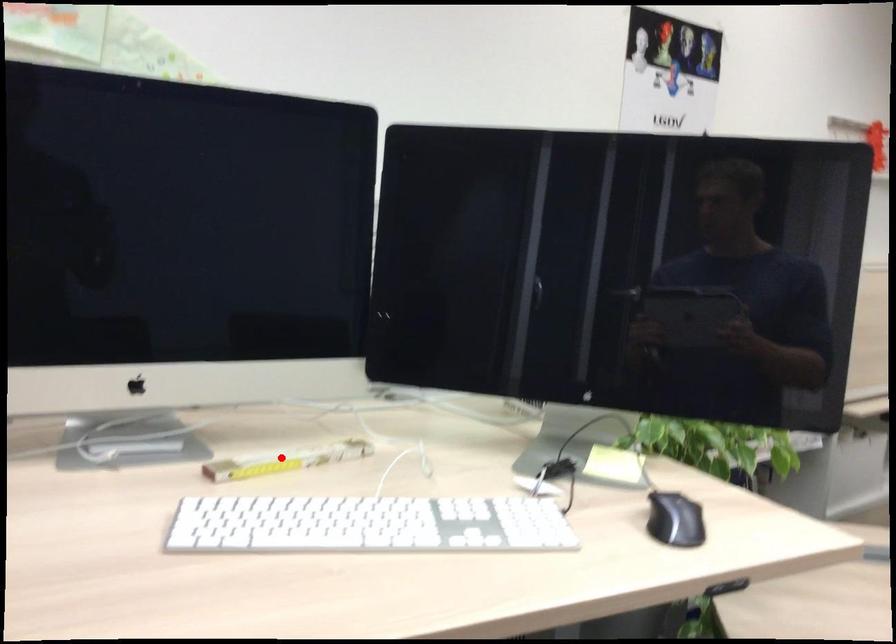
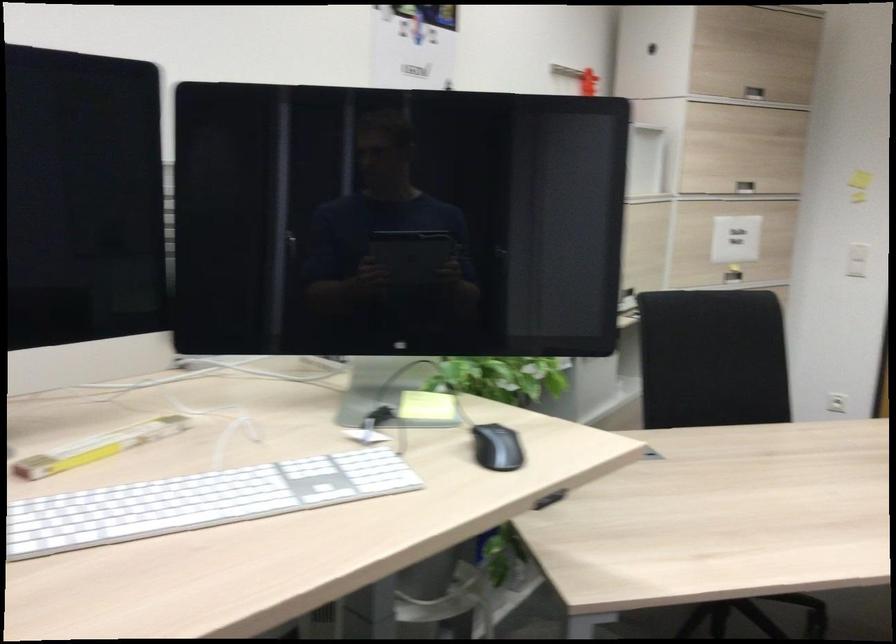
Locate, in the second image, the point that corresponds to the highlighted location in the first image.

(98, 447)